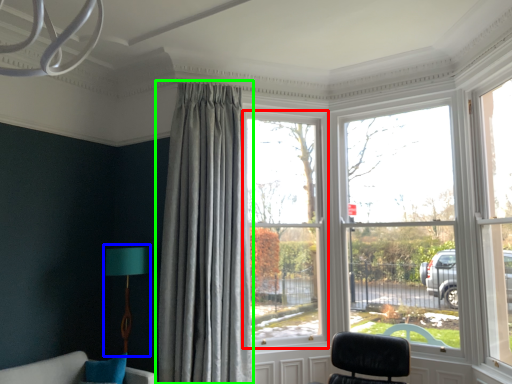
Question: Estimate the real-world distances between objects in this image. Which object is closer to window (highlighted by a red box), table lamp (highlighted by a blue box) or curtain (highlighted by a green box)?

Choices:
 (A) table lamp
 (B) curtain

Answer: (B)